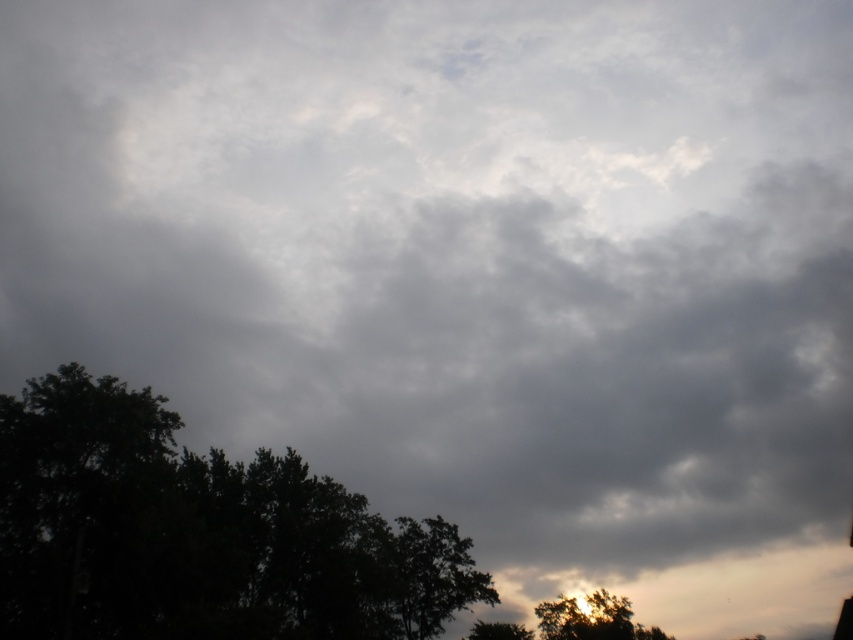
You are a bird looking for a nesting spot. You see the green leafy tree at lower left and the golden textured tree at lower right. Which tree is taller and would provide a better vantage point?

The green leafy tree at lower left is taller than the golden textured tree at lower right, so it would provide a better vantage point.

You are standing in a field and see the green leafy tree at lower left and the green leafy tree at lower center. Which tree is closer to you?

The green leafy tree at lower left is closer to you because it is in front of the green leafy tree at lower center.

You are standing in a field looking at the sky. You notice a bright spot in the sky at coordinates point (196, 532). Based on the scene, what object is located at that point?

The point (196, 532) corresponds to the green leafy tree at lower left.